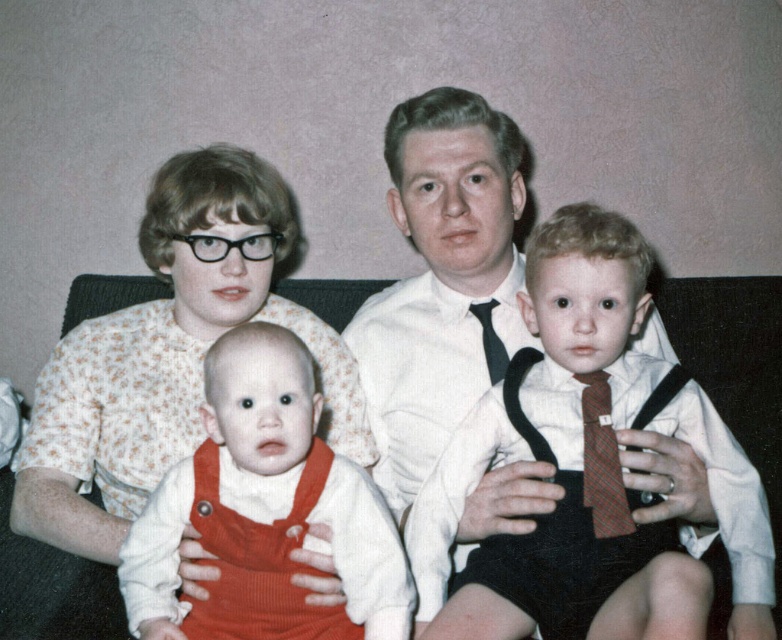
Looking at the family portrait, where is the matte corduroy overalls at center in relation to the black satin tie at center?

The matte corduroy overalls at center are positioned to the left of the black satin tie at center.

You are standing in front of the family portrait and want to touch the two points labeled point (357, 541) and point (601, 456). Which point should you reach for first if you want to touch the one closer to you?

Point (357, 541) is closer to the viewer than point (601, 456), so you should reach for point (357, 541) first.